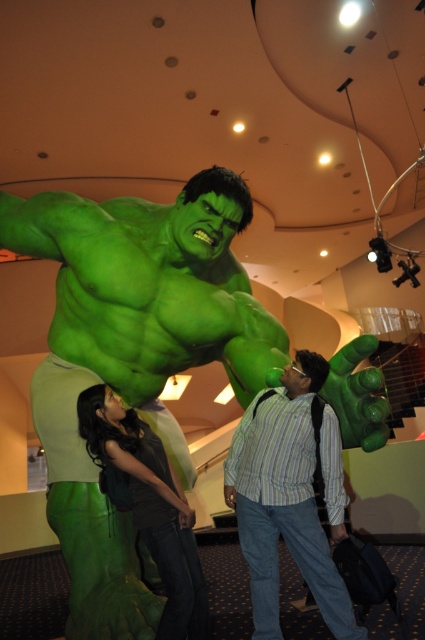
Between green rubber statue at center and matte green costume at lower left, which one has more height?

With more height is green rubber statue at center.

Describe the element at coordinates (133, 358) in the screenshot. I see `green rubber statue at center` at that location.

Where is `green rubber statue at center`? green rubber statue at center is located at coordinates (133, 358).

Locate an element on the screen. The image size is (425, 640). striped cotton shirt at center is located at coordinates (289, 493).

Is point (271, 602) closer to camera compared to point (180, 525)?

No, it is not.

Locate an element on the screen. striped cotton shirt at center is located at coordinates (289, 493).

Does green rubber statue at center have a greater height compared to striped cotton shirt at center?

Indeed, green rubber statue at center has a greater height compared to striped cotton shirt at center.

Which is behind, point (198, 200) or point (258, 467)?

Positioned behind is point (258, 467).

Does point (70, 404) come farther from viewer compared to point (238, 458)?

No.

You are a GUI agent. You are given a task and a screenshot of the screen. Output one action in this format:
    pyautogui.click(x=<x>, y=<y>)
    Task: Click on the green rubber statue at center
    The width and height of the screenshot is (425, 640).
    Given the screenshot: What is the action you would take?
    click(x=133, y=358)